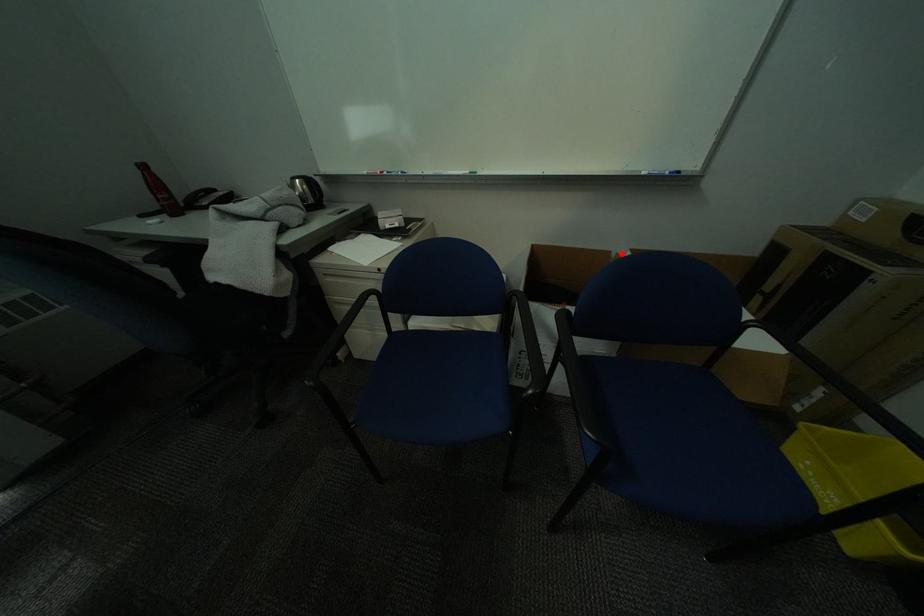
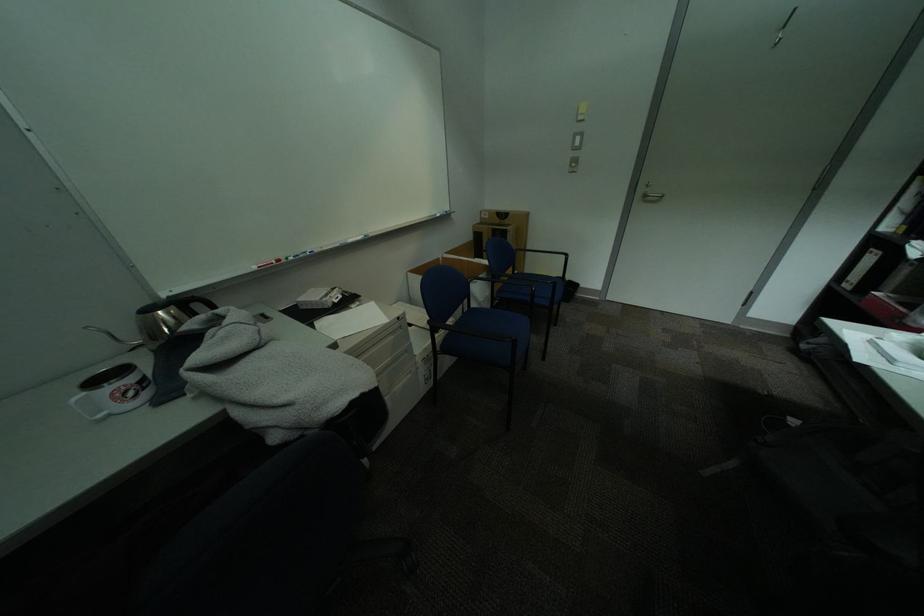
Where in the second image is the point corresponding to the highlighted location from the first image?

(450, 259)